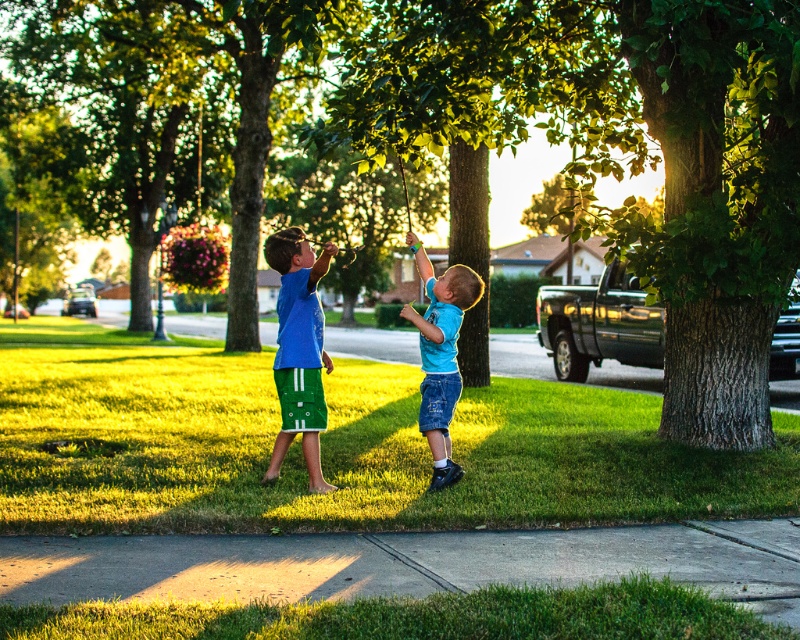
Does gray concrete pavement at lower center have a larger size compared to green fabric shorts at center?

No, gray concrete pavement at lower center is not bigger than green fabric shorts at center.

Looking at this image, can you confirm if gray concrete pavement at lower center is positioned above green fabric shorts at center?

Incorrect, gray concrete pavement at lower center is not positioned above green fabric shorts at center.

Which is behind, point (188, 577) or point (310, 276)?

Positioned behind is point (310, 276).

Where is `gray concrete pavement at lower center`? gray concrete pavement at lower center is located at coordinates (406, 563).

Between point (708, 248) and point (292, 280), which one is positioned behind?

Point (708, 248)

Does green leafy tree at center have a greater height compared to green fabric shorts at center?

No.

Which is in front, point (754, 120) or point (318, 380)?

Positioned in front is point (318, 380).

At what (x,y) coordinates should I click in order to perform the action: click on green leafy tree at center. Please return your answer as a coordinate pair (x, y). Looking at the image, I should click on tap(626, 152).

Is green leafy tree at center bigger than gray concrete pavement at lower center?

Actually, green leafy tree at center might be smaller than gray concrete pavement at lower center.

Does green leafy tree at center appear on the right side of gray concrete pavement at lower center?

Correct, you'll find green leafy tree at center to the right of gray concrete pavement at lower center.

Describe the element at coordinates (626, 152) in the screenshot. The width and height of the screenshot is (800, 640). I see `green leafy tree at center` at that location.

Locate an element on the screen. This screenshot has width=800, height=640. green leafy tree at center is located at coordinates (626, 152).